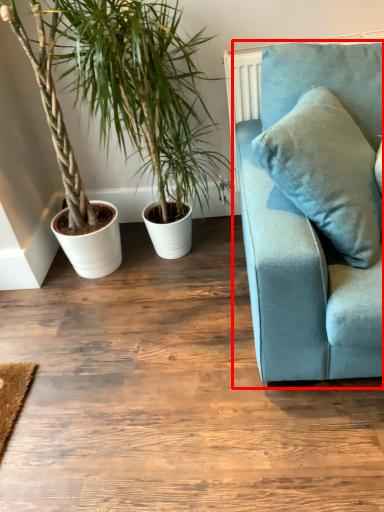
Question: In this image, where is studio couch (annotated by the red box) located relative to houseplant?

Choices:
 (A) right
 (B) left

Answer: (A)